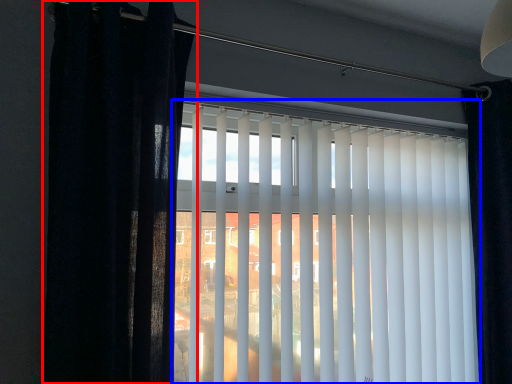
Question: Which object is closer to the camera taking this photo, curtain (highlighted by a red box) or window blind (highlighted by a blue box)?

Choices:
 (A) curtain
 (B) window blind

Answer: (A)